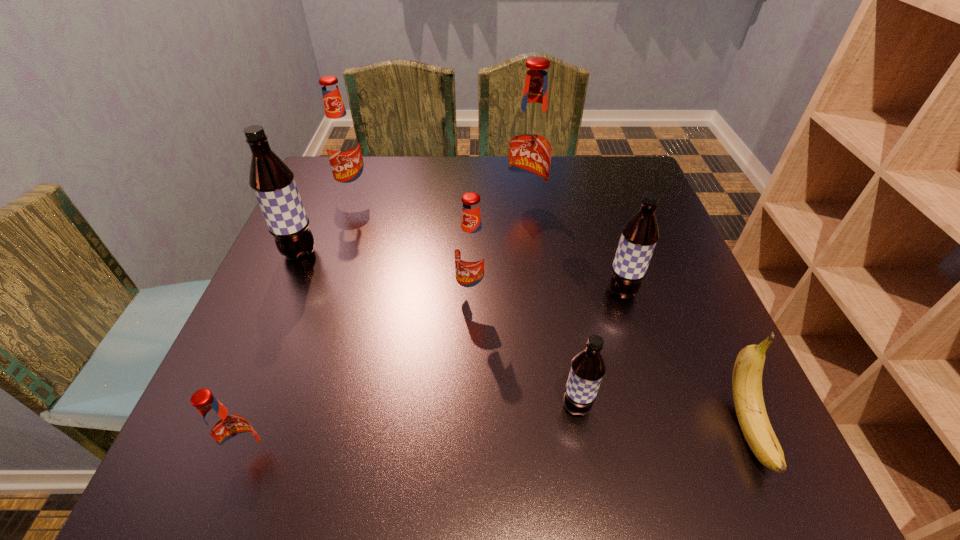
The image size is (960, 540). Identify the location of the tallest object. pyautogui.click(x=530, y=147).

At what (x,y) coordinates should I click in order to perform the action: click on the biggest red root beer. Please return your answer as a coordinate pair (x, y). This screenshot has height=540, width=960. Looking at the image, I should click on (530, 147).

Where is `the second biggest red root beer`? Image resolution: width=960 pixels, height=540 pixels. the second biggest red root beer is located at coordinates (342, 142).

In order to click on the farthest brown root beer in this screenshot , I will do `click(272, 181)`.

Where is `the biggest brown root beer`? the biggest brown root beer is located at coordinates (272, 181).

The height and width of the screenshot is (540, 960). Identify the location of the third red root beer from left to right. (471, 250).

Where is `the second smallest red root beer`? The image size is (960, 540). the second smallest red root beer is located at coordinates 471,250.

Where is `the second farthest brown root beer`? The image size is (960, 540). the second farthest brown root beer is located at coordinates (639, 236).

Locate an element on the screen. Image resolution: width=960 pixels, height=540 pixels. the rightmost root beer is located at coordinates (639, 236).

I want to click on the nearest red root beer, so [230, 433].